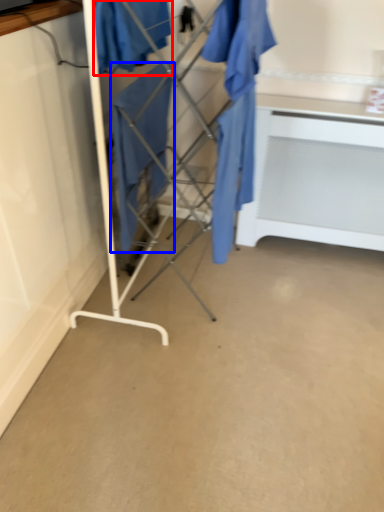
Question: Which of the following is the closest to the observer, clothing (highlighted by a red box) or clothing (highlighted by a blue box)?

Choices:
 (A) clothing
 (B) clothing

Answer: (A)